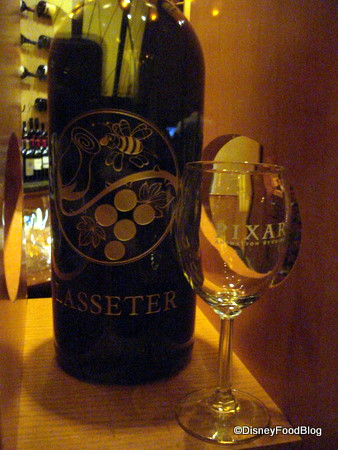
Where is `space to left of closest wine bottle`? Image resolution: width=338 pixels, height=450 pixels. space to left of closest wine bottle is located at coordinates (34, 191).